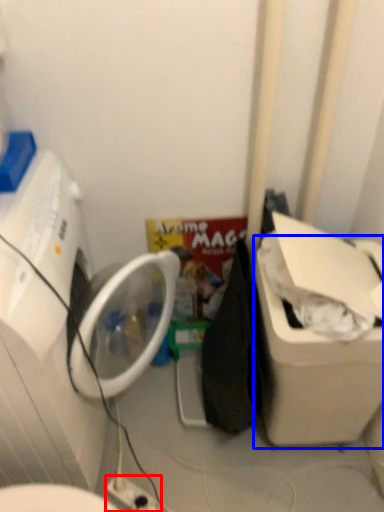
Question: Among these objects, which one is nearest to the camera, electric outlet (highlighted by a red box) or water cooler (highlighted by a blue box)?

Choices:
 (A) electric outlet
 (B) water cooler

Answer: (B)